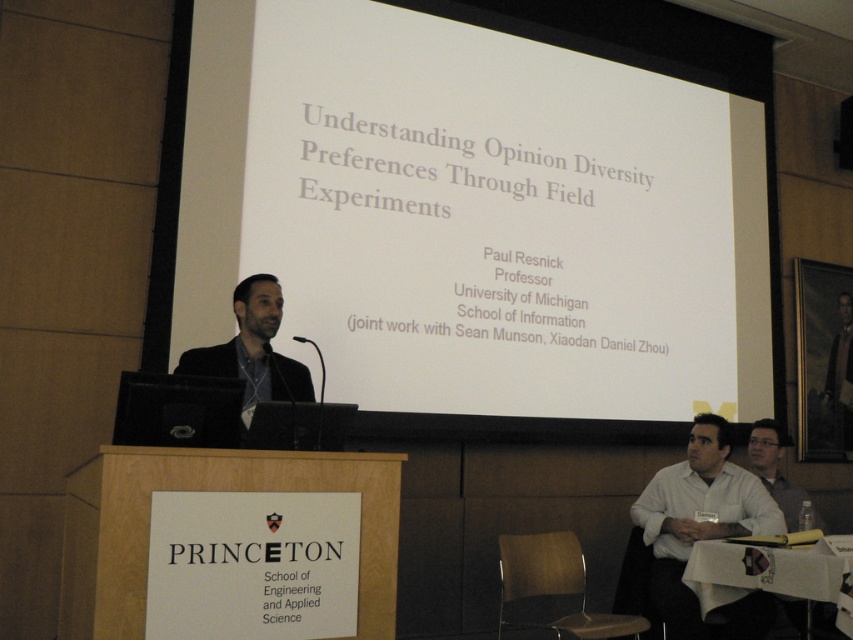
Question: Which is nearer to the white shirt at lower right?

Choices:
 (A) dark suit at center
 (B) white matte projection screen at upper center

Answer: (B)

Question: Does white matte projection screen at upper center lie in front of white shirt at lower right?

Choices:
 (A) no
 (B) yes

Answer: (A)

Question: Estimate the real-world distances between objects in this image. Which object is closer to the white matte projection screen at upper center?

Choices:
 (A) white shirt at lower right
 (B) dark suit at center

Answer: (B)

Question: Estimate the real-world distances between objects in this image. Which object is closer to the white shirt at lower right?

Choices:
 (A) dark suit at center
 (B) white matte projection screen at upper center

Answer: (B)

Question: Is white shirt at lower right to the left of dark suit at center from the viewer's perspective?

Choices:
 (A) no
 (B) yes

Answer: (A)

Question: Can you confirm if white shirt at lower right is positioned to the right of dark suit at center?

Choices:
 (A) no
 (B) yes

Answer: (B)